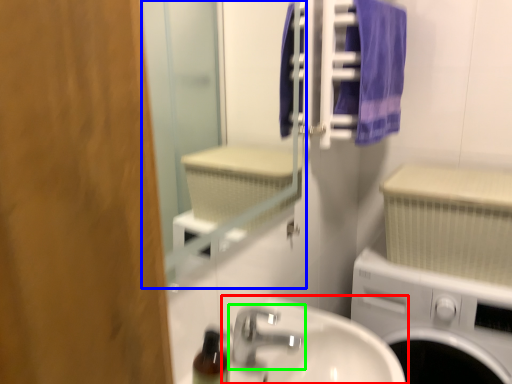
Question: Considering the real-world distances, which object is farthest from sink (highlighted by a red box)? mirror (highlighted by a blue box) or tap (highlighted by a green box)?

Choices:
 (A) mirror
 (B) tap

Answer: (A)